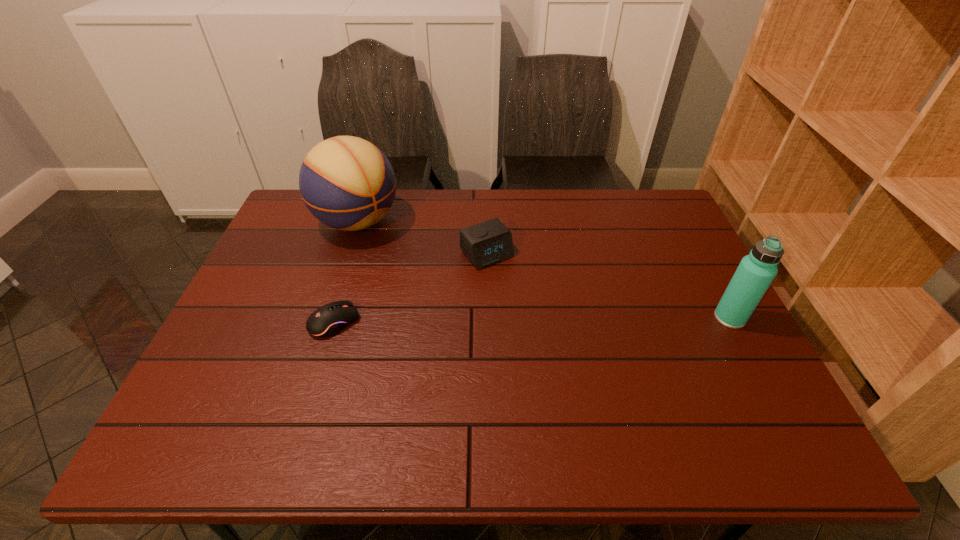
Find the location of a particular element. free point located on the patterned surface of the basketball is located at coordinates (472, 314).

This screenshot has height=540, width=960. Find the location of `vacant position located 0.360m on the patterned surface of the basketball`. vacant position located 0.360m on the patterned surface of the basketball is located at coordinates (462, 306).

Identify the location of vacant space located 0.260m on the patterned surface of the basketball. (437, 286).

Image resolution: width=960 pixels, height=540 pixels. What are the coordinates of `object that is positioned at the far edge` in the screenshot? It's located at (346, 182).

The image size is (960, 540). What are the coordinates of `object present at the left edge` in the screenshot? It's located at (346, 182).

I want to click on object at the right edge, so click(756, 271).

Locate an element on the screen. object at the far left corner is located at coordinates (346, 182).

The width and height of the screenshot is (960, 540). In the image, there is a desktop. What are the coordinates of `vacant space at the far edge` in the screenshot? It's located at (572, 200).

This screenshot has height=540, width=960. I want to click on free space at the near edge, so pyautogui.click(x=666, y=400).

Locate an element on the screen. The image size is (960, 540). free space at the left edge of the desktop is located at coordinates (281, 258).